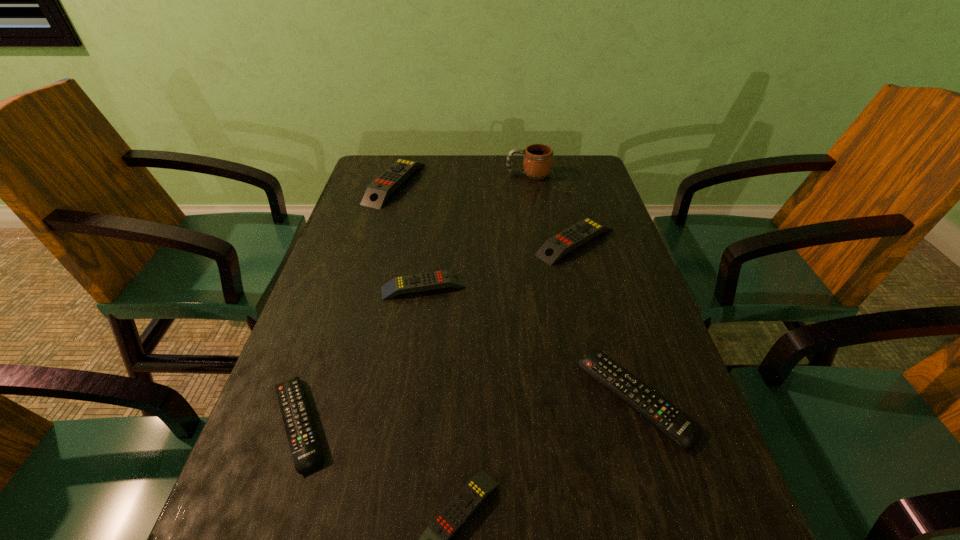
Where is `mug`? The width and height of the screenshot is (960, 540). mug is located at coordinates (537, 158).

Locate an element on the screen. The image size is (960, 540). the farthest remote control is located at coordinates (378, 191).

Where is `the biggest yellow remote control`? The image size is (960, 540). the biggest yellow remote control is located at coordinates (378, 191).

You are a GUI agent. You are given a task and a screenshot of the screen. Output one action in this format:
    pyautogui.click(x=<x>, y=<y>)
    Task: Click on the second farthest remote control
    The height and width of the screenshot is (540, 960).
    Given the screenshot: What is the action you would take?
    pyautogui.click(x=554, y=248)

The image size is (960, 540). What are the coordinates of `the fifth shortest object` in the screenshot? It's located at (554, 248).

Where is `the fourth farthest object`? The image size is (960, 540). the fourth farthest object is located at coordinates (420, 282).

Locate an element on the screen. the fourth nearest remote control is located at coordinates (420, 282).

Find the location of a particular element. The width and height of the screenshot is (960, 540). the right black remote control is located at coordinates (679, 427).

Where is `the left black remote control`? The image size is (960, 540). the left black remote control is located at coordinates (307, 456).

This screenshot has height=540, width=960. Find the location of `free space located on the side of the tallest object with the handle`. free space located on the side of the tallest object with the handle is located at coordinates (393, 174).